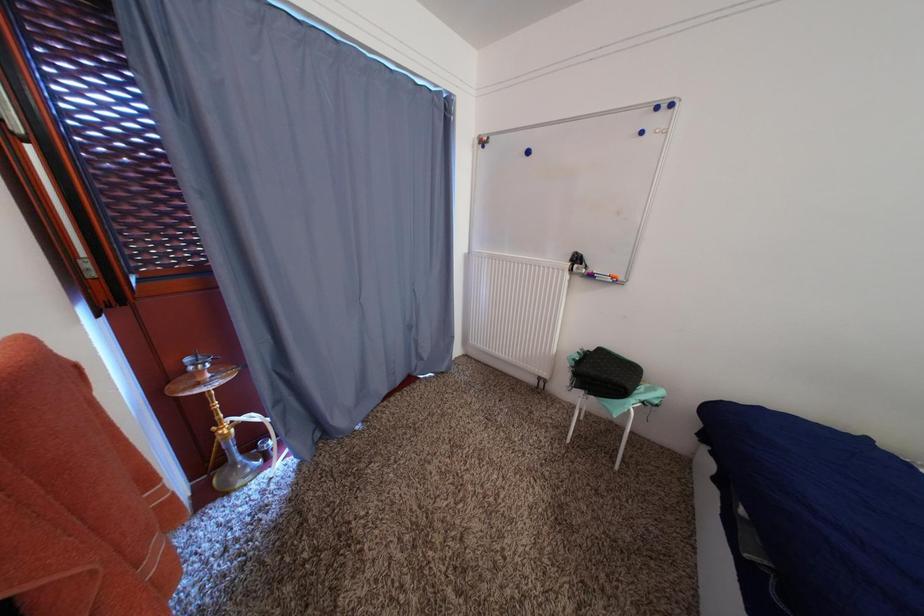
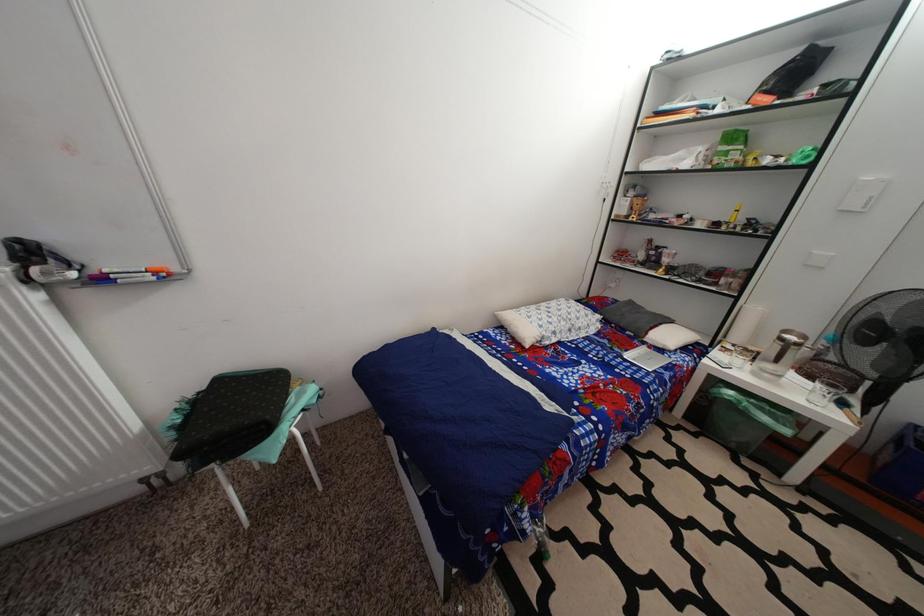
First-person continuous shooting, in which direction is the camera rotating?

The camera rotated toward right-down.